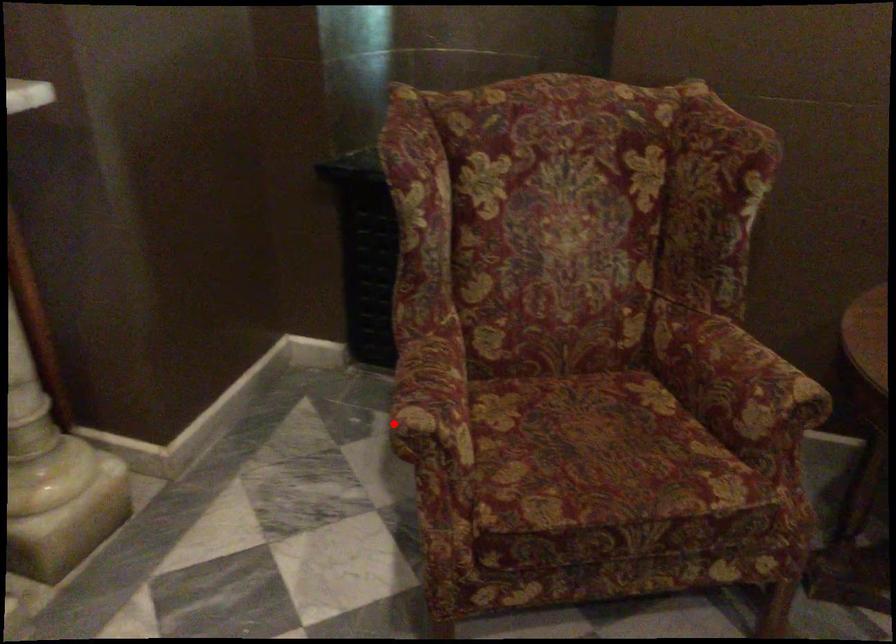
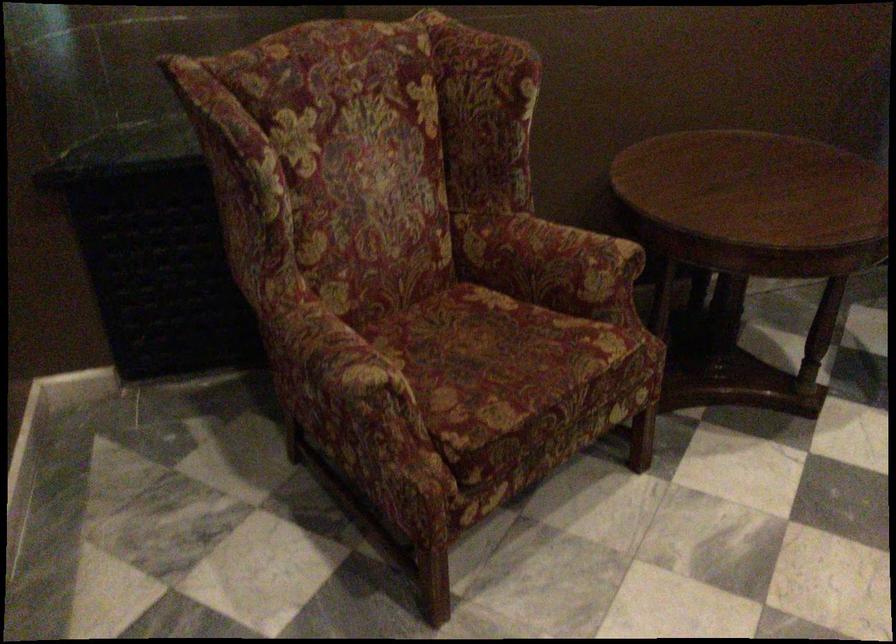
The point at the highlighted location is marked in the first image. Where is the corresponding point in the second image?

(343, 389)